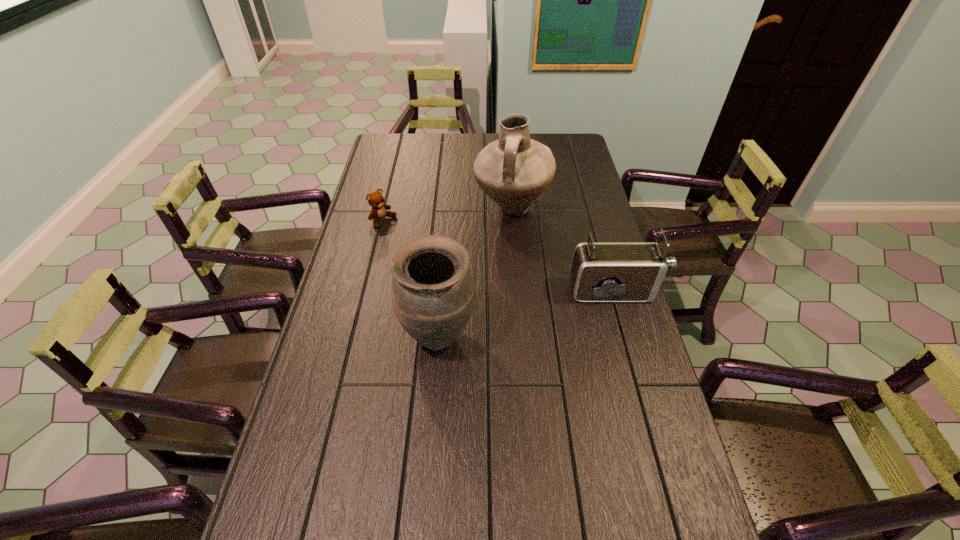
This screenshot has width=960, height=540. What are the coordinates of `vacant space located 0.220m on the front-facing side of the shortest object` in the screenshot? It's located at pyautogui.click(x=432, y=255).

The image size is (960, 540). Find the location of `vacant space located on the handle side of the tallest object`. vacant space located on the handle side of the tallest object is located at coordinates (522, 254).

The image size is (960, 540). I want to click on vacant space located 0.240m on the handle side of the tallest object, so click(x=528, y=282).

Where is `free point located on the handle side of the tallest object`? free point located on the handle side of the tallest object is located at coordinates (528, 282).

At what (x,y) coordinates should I click in order to perform the action: click on object at the left edge. Please return your answer as a coordinate pair (x, y). The width and height of the screenshot is (960, 540). Looking at the image, I should click on (376, 200).

The image size is (960, 540). I want to click on object situated at the right edge, so click(x=601, y=271).

In the image, there is a desktop. Where is `vacant area at the far edge`? Image resolution: width=960 pixels, height=540 pixels. vacant area at the far edge is located at coordinates (476, 152).

In order to click on vacant space at the left edge of the desktop in this screenshot , I will do `click(367, 359)`.

The height and width of the screenshot is (540, 960). Identify the location of vacant space at the right edge of the desktop. (572, 190).

Image resolution: width=960 pixels, height=540 pixels. I want to click on vacant space at the near right corner of the desktop, so click(631, 509).